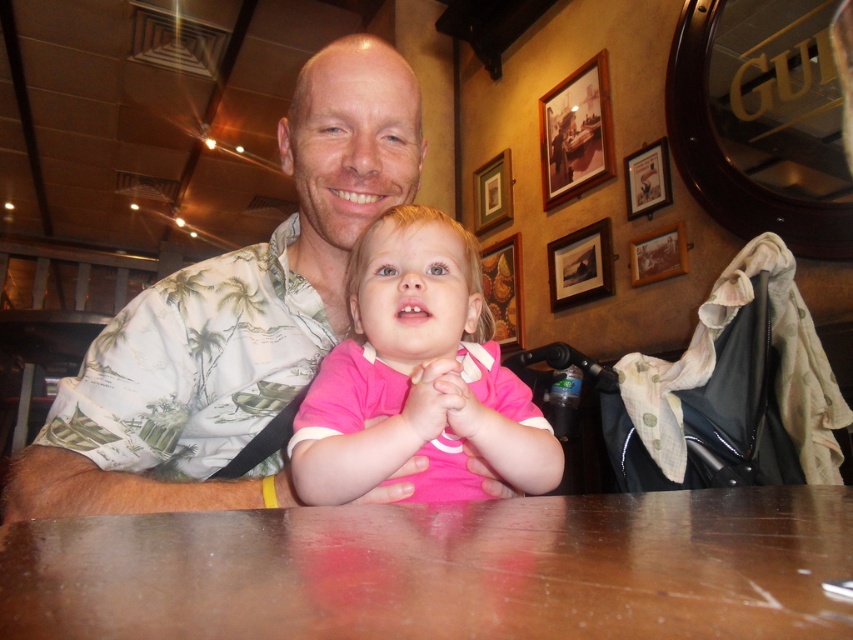
You are sitting at the wooden table at center and want to look at the wooden picture frame at upper center. Can you see it without moving your head?

The wooden table at center is in front of the wooden picture frame at upper center, so yes, you can see it without moving your head because the table is positioned between you and the frame, but the frame is still visible above or around the table.

You are sitting at the table in the image and want to reach both the point at coordinates point (x=498, y=552) and the point at coordinates point (x=169, y=438). Which point will require you to reach further away from your current position?

The point at coordinates point (x=169, y=438) will require reaching further away because it is farther from the viewer compared to point (x=498, y=552).